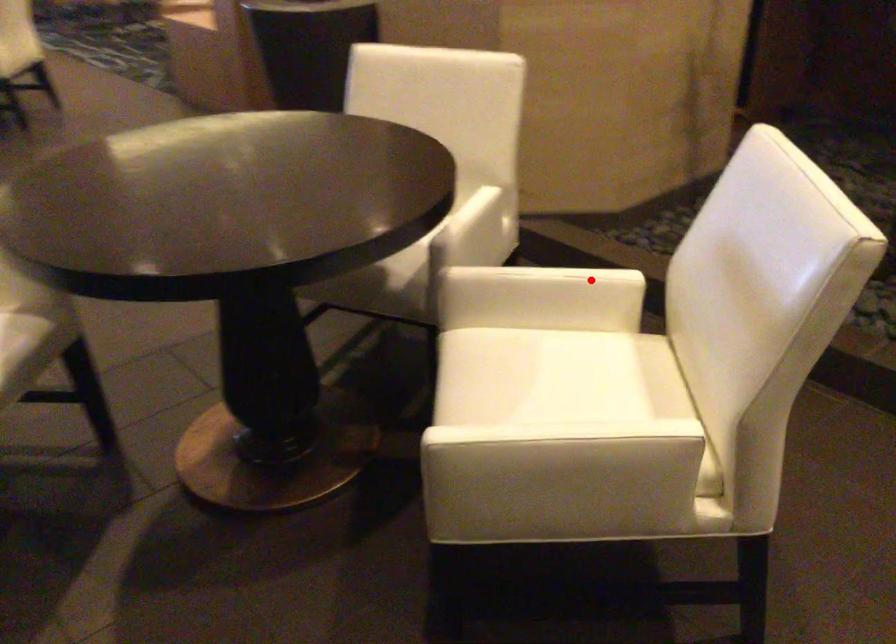
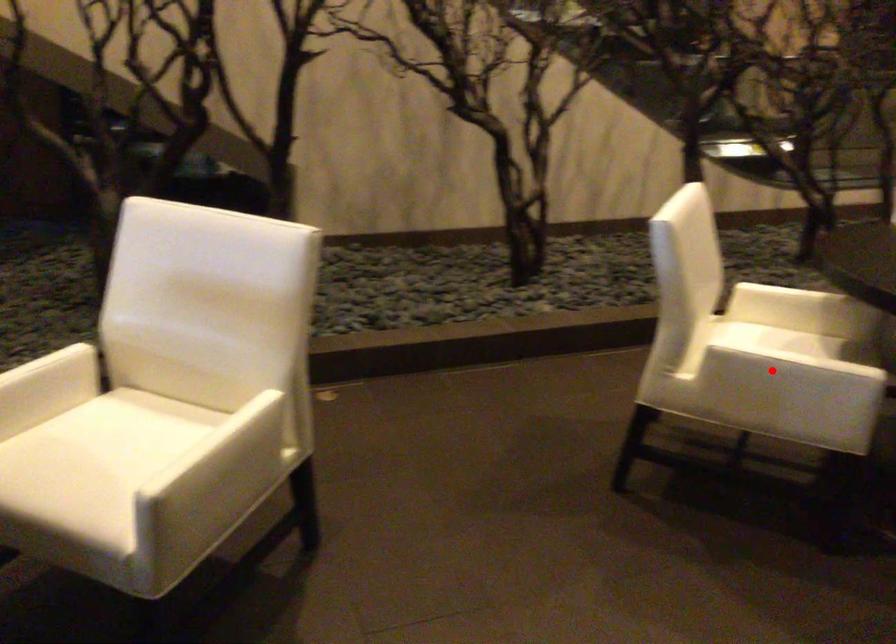
I am providing you with two images of the same scene from different viewpoints. A red point is marked on the first image and another point is marked on the second image. Does the point marked in image1 correspond to the same location as the one in image2?

No